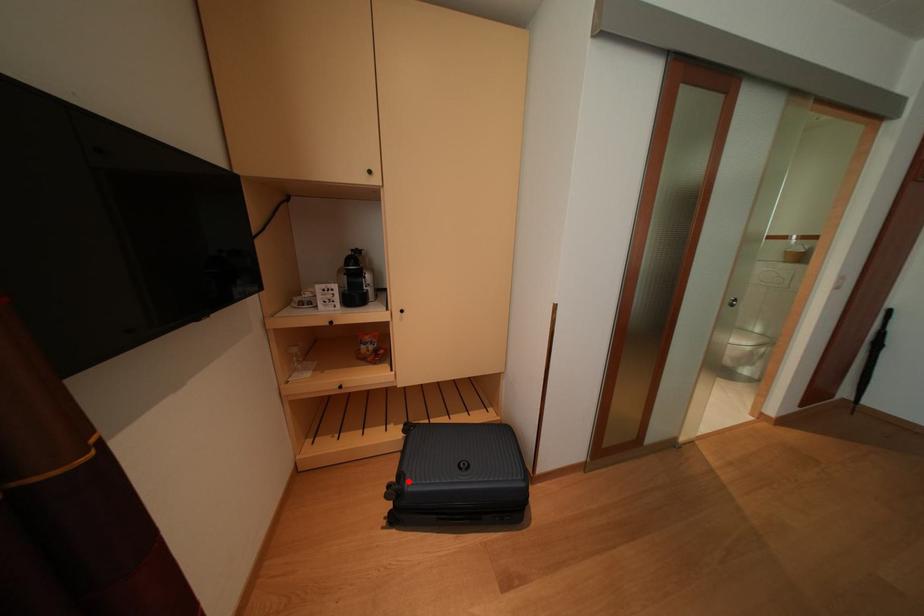
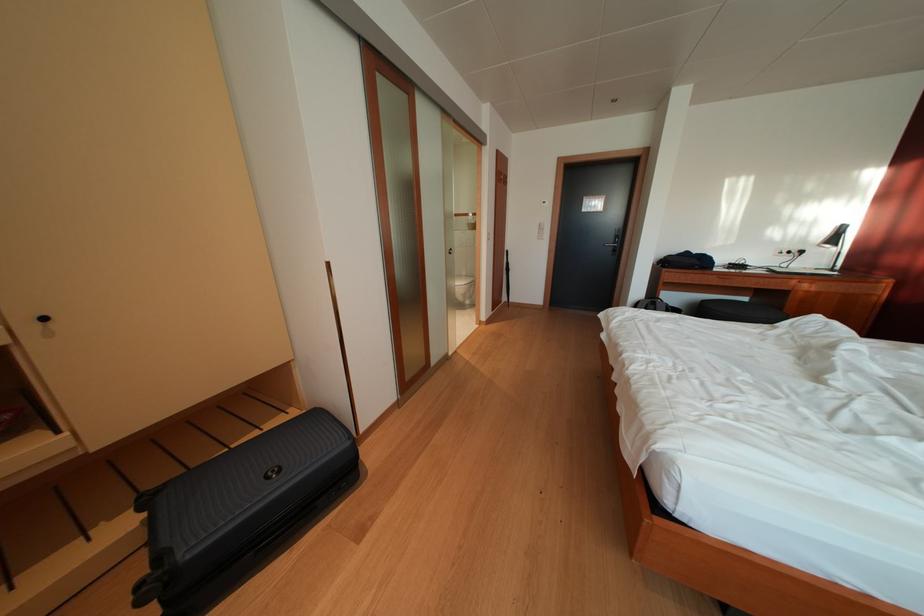
Question: I am providing you with two images of the same scene from different viewpoints. Image1 has a red point marked. In image2, the corresponding 3D location appears at what relative position? Reply with the corresponding letter.

Choices:
 (A) Closer
 (B) Farther

Answer: (B)